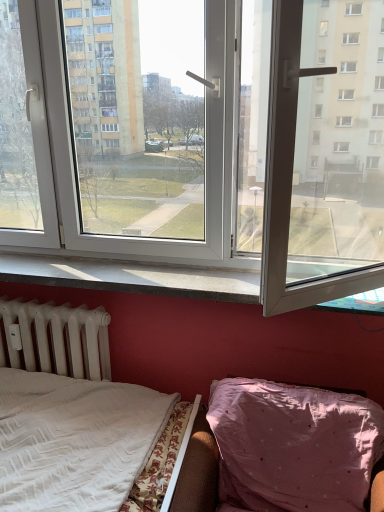
Question: From the image's perspective, is white plastic window at center over pink fabric hospital bed at lower right?

Choices:
 (A) yes
 (B) no

Answer: (A)

Question: Considering the relative sizes of white plastic window at center and pink fabric hospital bed at lower right in the image provided, is white plastic window at center shorter than pink fabric hospital bed at lower right?

Choices:
 (A) no
 (B) yes

Answer: (A)

Question: From a real-world perspective, is white plastic window at center beneath pink fabric hospital bed at lower right?

Choices:
 (A) no
 (B) yes

Answer: (A)

Question: Considering the relative sizes of white plastic window at center and pink fabric hospital bed at lower right in the image provided, is white plastic window at center thinner than pink fabric hospital bed at lower right?

Choices:
 (A) yes
 (B) no

Answer: (A)

Question: Is white plastic window at center positioned far away from pink fabric hospital bed at lower right?

Choices:
 (A) no
 (B) yes

Answer: (B)

Question: Can you confirm if white plastic window at center is wider than pink fabric hospital bed at lower right?

Choices:
 (A) yes
 (B) no

Answer: (B)

Question: Is pink fabric hospital bed at lower right with white matte radiator at lower left?

Choices:
 (A) yes
 (B) no

Answer: (B)

Question: From the image's perspective, is pink fabric hospital bed at lower right on white matte radiator at lower left?

Choices:
 (A) no
 (B) yes

Answer: (A)

Question: From a real-world perspective, is pink fabric hospital bed at lower right physically above white matte radiator at lower left?

Choices:
 (A) yes
 (B) no

Answer: (B)

Question: Does pink fabric hospital bed at lower right have a lesser width compared to white matte radiator at lower left?

Choices:
 (A) no
 (B) yes

Answer: (A)

Question: Is the depth of pink fabric hospital bed at lower right less than that of white matte radiator at lower left?

Choices:
 (A) yes
 (B) no

Answer: (A)

Question: Does pink fabric hospital bed at lower right have a lesser height compared to white matte radiator at lower left?

Choices:
 (A) yes
 (B) no

Answer: (B)

Question: From a real-world perspective, is white matte radiator at lower left physically above white plastic window at center?

Choices:
 (A) yes
 (B) no

Answer: (B)